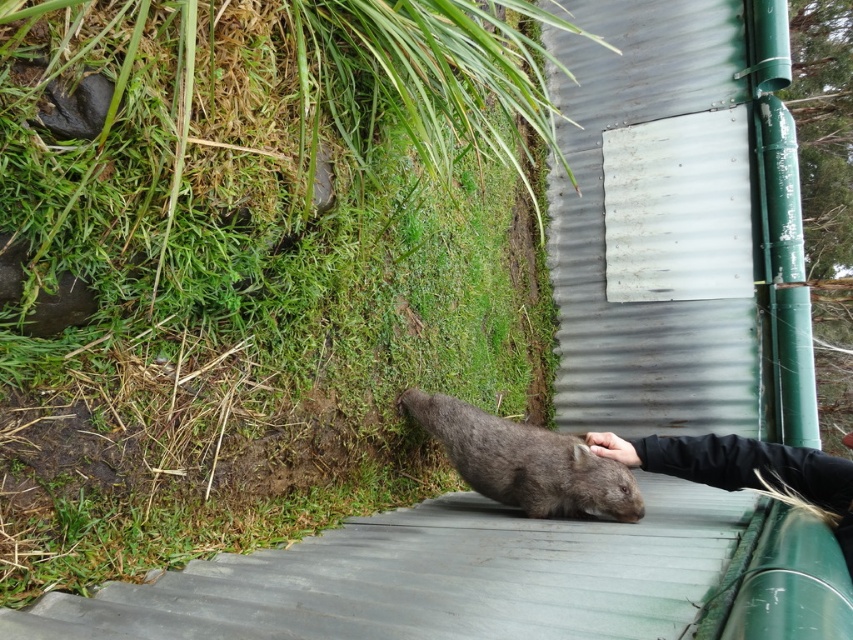
Does black fabric hand at lower center have a smaller size compared to black leather hand at lower center?

No, black fabric hand at lower center is not smaller than black leather hand at lower center.

Where is `black fabric hand at lower center`? This screenshot has width=853, height=640. black fabric hand at lower center is located at coordinates (746, 468).

The image size is (853, 640). Identify the location of black fabric hand at lower center. (746, 468).

Can you confirm if green grass at lower left is thinner than fuzzy gray wombat at lower center?

No, green grass at lower left is not thinner than fuzzy gray wombat at lower center.

What do you see at coordinates (254, 266) in the screenshot? I see `green grass at lower left` at bounding box center [254, 266].

Is point (310, 193) positioned after point (409, 392)?

No.

Find the location of a particular element. The height and width of the screenshot is (640, 853). green grass at lower left is located at coordinates (254, 266).

Who is more forward, [531,227] or [671,467]?

Point [671,467]

Looking at this image, is green grass at lower left positioned behind black fabric hand at lower center?

No, it is in front of black fabric hand at lower center.

Which is in front, point (135, 520) or point (721, 476)?

Point (135, 520) is more forward.

Locate an element on the screen. green grass at lower left is located at coordinates (254, 266).